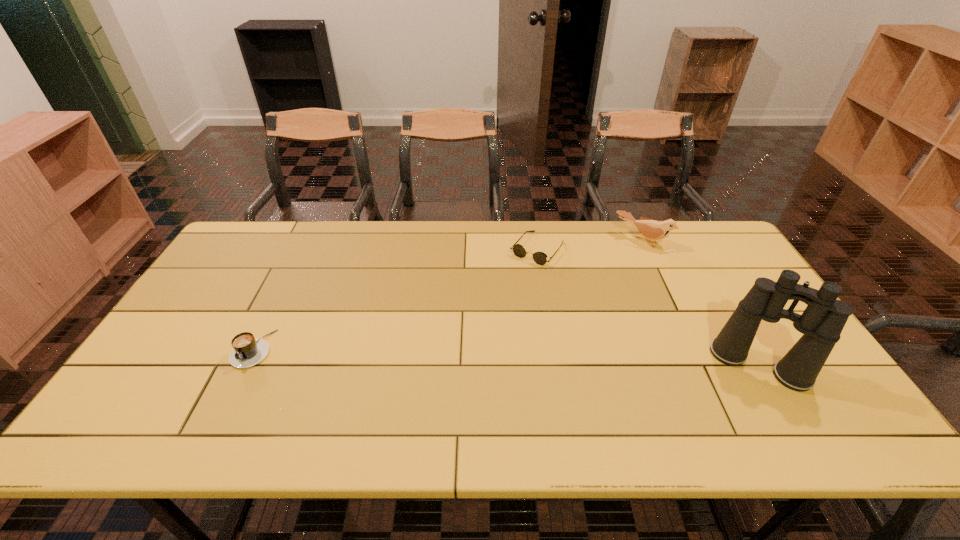
Locate an element on the screen. The height and width of the screenshot is (540, 960). the leftmost object is located at coordinates (247, 351).

Locate an element on the screen. the tallest object is located at coordinates (821, 323).

The image size is (960, 540). What are the coordinates of `the second object from left to right` in the screenshot? It's located at (540, 258).

Identify the location of the third shortest object. (654, 230).

You are a GUI agent. You are given a task and a screenshot of the screen. Output one action in this format:
    pyautogui.click(x=<x>, y=<y>)
    Task: Click on the free location located 0.060m with the handle on the side of the cappuccino
    
    Given the screenshot: What is the action you would take?
    pyautogui.click(x=232, y=390)

The width and height of the screenshot is (960, 540). I want to click on free space located on the back of the binoculars, so click(724, 306).

Image resolution: width=960 pixels, height=540 pixels. Find the location of `free spot located 0.400m on the front-facing side of the third object from right to left`. free spot located 0.400m on the front-facing side of the third object from right to left is located at coordinates (455, 349).

What are the coordinates of `free region located on the front-facing side of the third object from right to left` in the screenshot? It's located at (461, 342).

Where is `vacant space located on the front-facing side of the third object from right to left`? The width and height of the screenshot is (960, 540). vacant space located on the front-facing side of the third object from right to left is located at coordinates (483, 316).

Image resolution: width=960 pixels, height=540 pixels. I want to click on free spot located at the beak of the second tallest object, so click(600, 296).